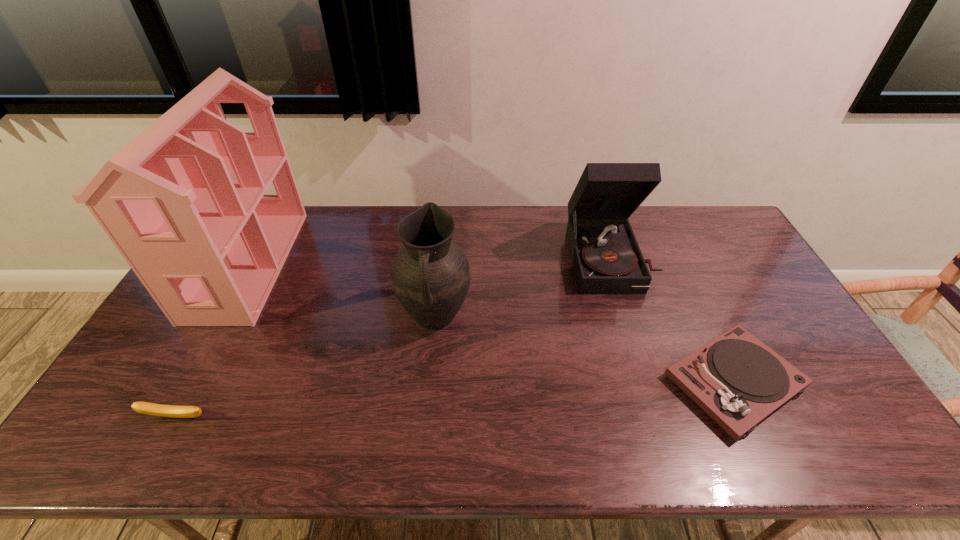
At what (x,y) coordinates should I click in order to perform the action: click on dollhouse positioned at the far edge. Please return your answer as a coordinate pair (x, y). Looking at the image, I should click on (183, 202).

At what (x,y) coordinates should I click in order to perform the action: click on phonograph_record that is at the far edge. Please return your answer as a coordinate pair (x, y). This screenshot has width=960, height=540. Looking at the image, I should click on (606, 257).

You are a GUI agent. You are given a task and a screenshot of the screen. Output one action in this format:
    pyautogui.click(x=<x>, y=<y>)
    Task: Click on the phonograph_record located at the near edge
    Image resolution: width=960 pixels, height=540 pixels.
    Given the screenshot: What is the action you would take?
    (x=736, y=379)

Locate an element on the screen. The width and height of the screenshot is (960, 540). banana that is at the near edge is located at coordinates (174, 411).

Image resolution: width=960 pixels, height=540 pixels. I want to click on dollhouse present at the left edge, so click(x=183, y=202).

Locate an element on the screen. banana that is at the left edge is located at coordinates (174, 411).

Find the location of `object that is at the right edge`. object that is at the right edge is located at coordinates 736,379.

The image size is (960, 540). Find the location of `object located in the far left corner section of the desktop`. object located in the far left corner section of the desktop is located at coordinates pyautogui.click(x=183, y=202).

Find the location of a particular element. Image resolution: width=960 pixels, height=540 pixels. object present at the near left corner is located at coordinates (174, 411).

The height and width of the screenshot is (540, 960). Find the location of `object that is at the near right corner`. object that is at the near right corner is located at coordinates (736, 379).